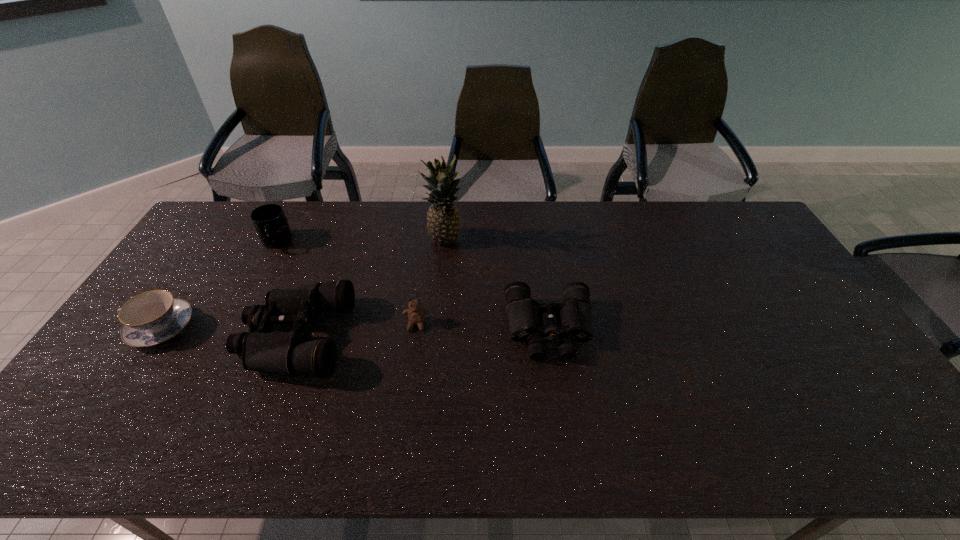
Find the location of a particular element. This screenshot has width=960, height=540. blank space at the near left corner of the desktop is located at coordinates (101, 390).

You are a GUI agent. You are given a task and a screenshot of the screen. Output one action in this format:
    pyautogui.click(x=<x>, y=<y>)
    Task: Click on the empty space that is in between the leftmost object and the mug
    The image size is (960, 540).
    Given the screenshot: What is the action you would take?
    [x=218, y=285]

Find the location of a particular element. The width and height of the screenshot is (960, 540). vacant space in between the shorter binoculars and the mug is located at coordinates (413, 286).

Where is `vacant region between the leftmost object and the taller binoculars`? The image size is (960, 540). vacant region between the leftmost object and the taller binoculars is located at coordinates (228, 332).

In order to click on unoccupied area between the chinaware and the rightmost object in this screenshot , I will do `click(355, 328)`.

Find the location of a particular element. The width and height of the screenshot is (960, 540). vacant space that's between the rightmost object and the leftmost object is located at coordinates (355, 328).

Locate an element on the screen. The height and width of the screenshot is (540, 960). free area in between the teddy bear and the leftmost object is located at coordinates (289, 326).

At what (x,y) coordinates should I click in order to perform the action: click on free space between the right binoculars and the taller binoculars. Please return your answer as a coordinate pair (x, y). The width and height of the screenshot is (960, 540). Looking at the image, I should click on (421, 333).

Select which object appears as the second closest to the leftmost object. Please provide its 2D coordinates. Your answer should be formatted as a tuple, i.e. [(x, y)], where the tuple contains the x and y coordinates of a point satisfying the conditions above.

[(270, 222)]

Where is `the fifth closest object to the mug`? The image size is (960, 540). the fifth closest object to the mug is located at coordinates (573, 316).